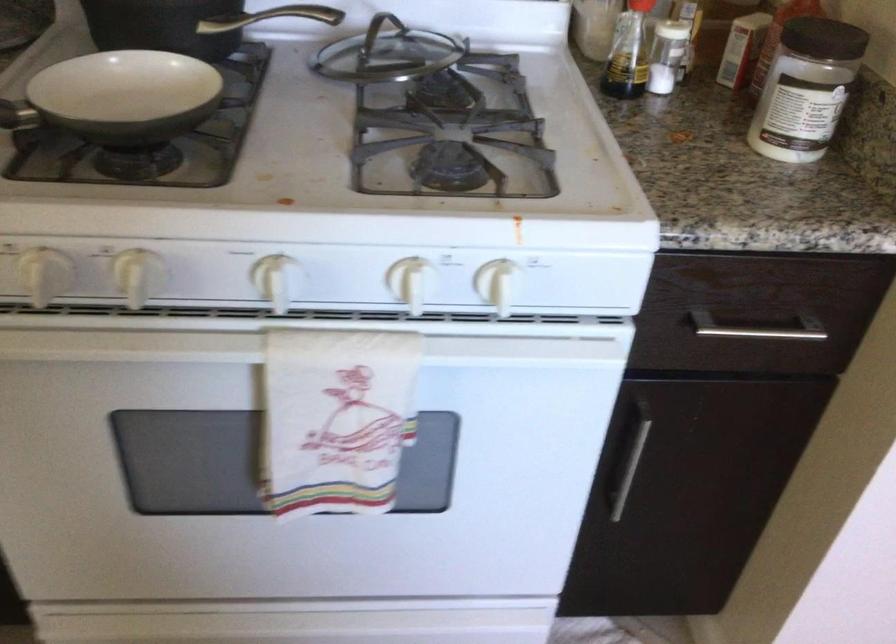
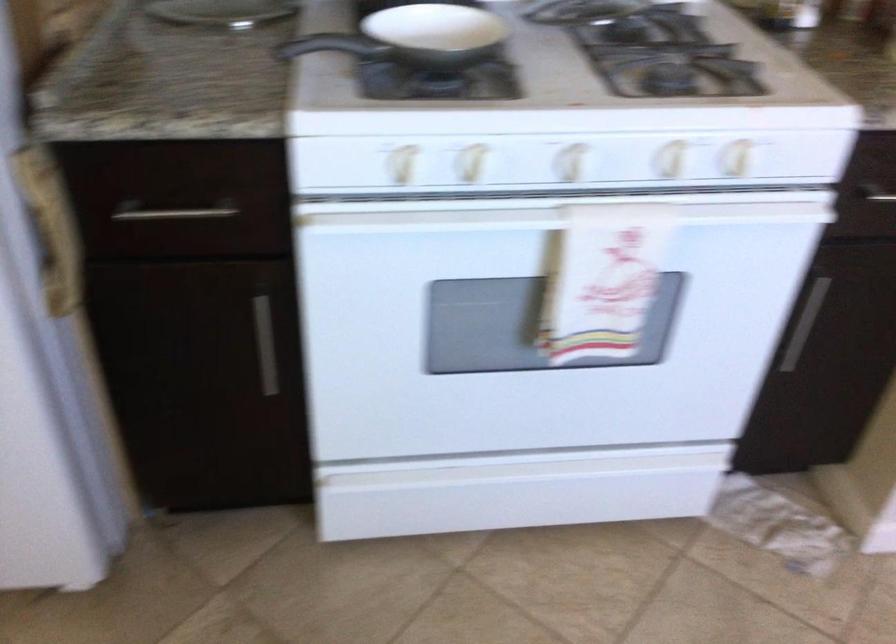
In the second image, find the point that corresponds to point 629,467 in the first image.

(805, 323)